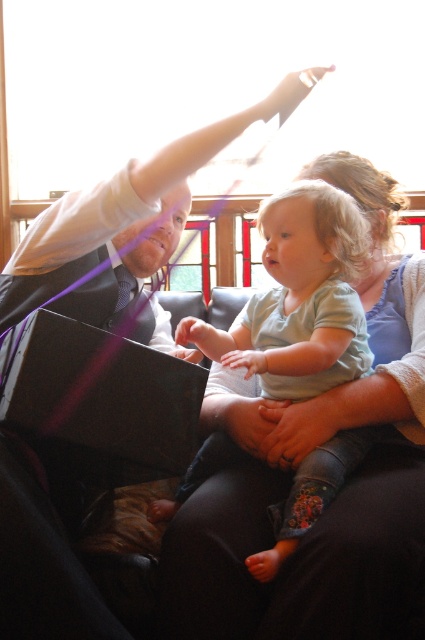
Measure the distance between matte black suit at upper left and camera.

4.90 feet

Does matte black suit at upper left have a lesser height compared to matte black laptop at lower left?

No.

Is point (93, 252) farther from viewer compared to point (155, 438)?

That is True.

You are a GUI agent. You are given a task and a screenshot of the screen. Output one action in this format:
    pyautogui.click(x=<x>, y=<y>)
    Task: Click on the matte black suit at upper left
    The image size is (425, 640).
    Given the screenshot: What is the action you would take?
    pyautogui.click(x=127, y=228)

Does matte black suit at upper left appear on the right side of light green cotton shirt at center?

Incorrect, matte black suit at upper left is not on the right side of light green cotton shirt at center.

Is matte black suit at upper left bigger than light green cotton shirt at center?

Yes, matte black suit at upper left is bigger than light green cotton shirt at center.

Which is in front, point (183, 198) or point (297, 400)?

Positioned in front is point (297, 400).

I want to click on matte black suit at upper left, so click(127, 228).

Who is more distant from viewer, (326,198) or (158,376)?

The point (326,198) is more distant.

What do you see at coordinates (300, 298) in the screenshot? The height and width of the screenshot is (640, 425). I see `light green cotton shirt at center` at bounding box center [300, 298].

Is point (342, 305) farther from viewer compared to point (124, 362)?

Yes.

The width and height of the screenshot is (425, 640). In order to click on light green cotton shirt at center in this screenshot , I will do `click(300, 298)`.